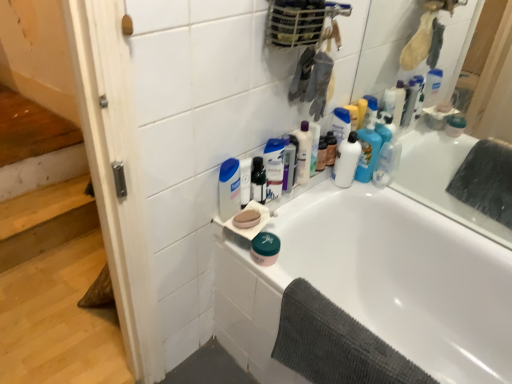
You are a GUI agent. You are given a task and a screenshot of the screen. Output one action in this format:
    pyautogui.click(x=<x>, y=<y>)
    Task: Click on the vacant region below white wood screen door at left (from a real-world perspective)
    This screenshot has height=384, width=512.
    Given the screenshot: What is the action you would take?
    pyautogui.click(x=105, y=312)